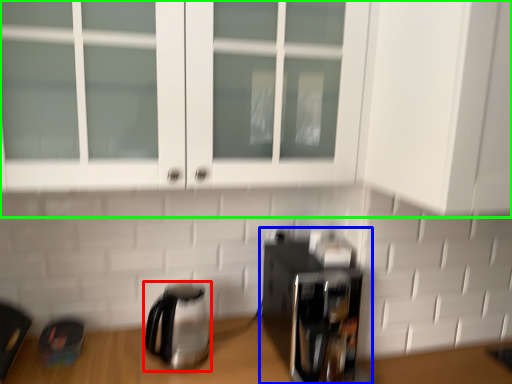
Question: Estimate the real-world distances between objects in this image. Which object is farther from kettle (highlighted by a red box), coffee maker (highlighted by a blue box) or cabinetry (highlighted by a green box)?

Choices:
 (A) coffee maker
 (B) cabinetry

Answer: (B)